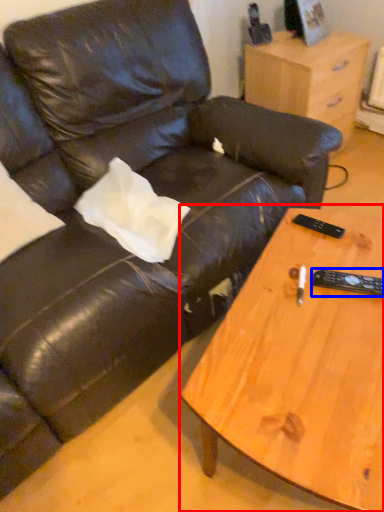
Question: Among these objects, which one is nearest to the camera, coffee table (highlighted by a red box) or remote (highlighted by a blue box)?

Choices:
 (A) coffee table
 (B) remote

Answer: (A)